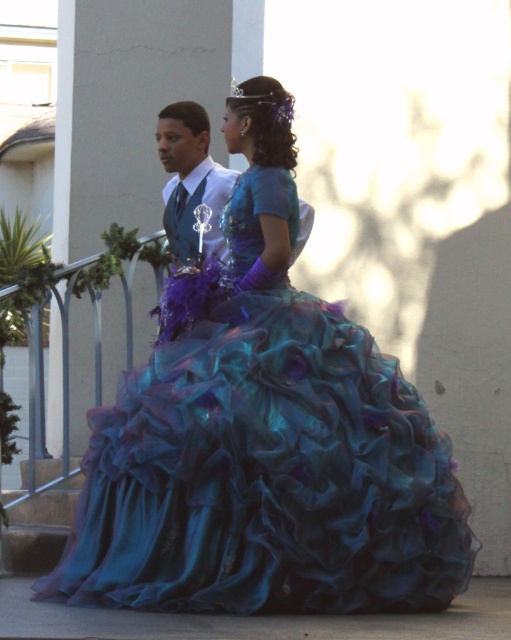
Question: Is teal satin gown at center below matte blue suit at center?

Choices:
 (A) yes
 (B) no

Answer: (A)

Question: Is teal satin gown at center to the left of matte blue suit at center from the viewer's perspective?

Choices:
 (A) yes
 (B) no

Answer: (B)

Question: Which object is farther from the camera taking this photo?

Choices:
 (A) teal satin gown at center
 (B) matte blue suit at center

Answer: (B)

Question: Which point appears closest to the camera in this image?

Choices:
 (A) (227, 365)
 (B) (216, 241)

Answer: (A)

Question: In this image, where is teal satin gown at center located relative to matte blue suit at center?

Choices:
 (A) right
 (B) left

Answer: (A)